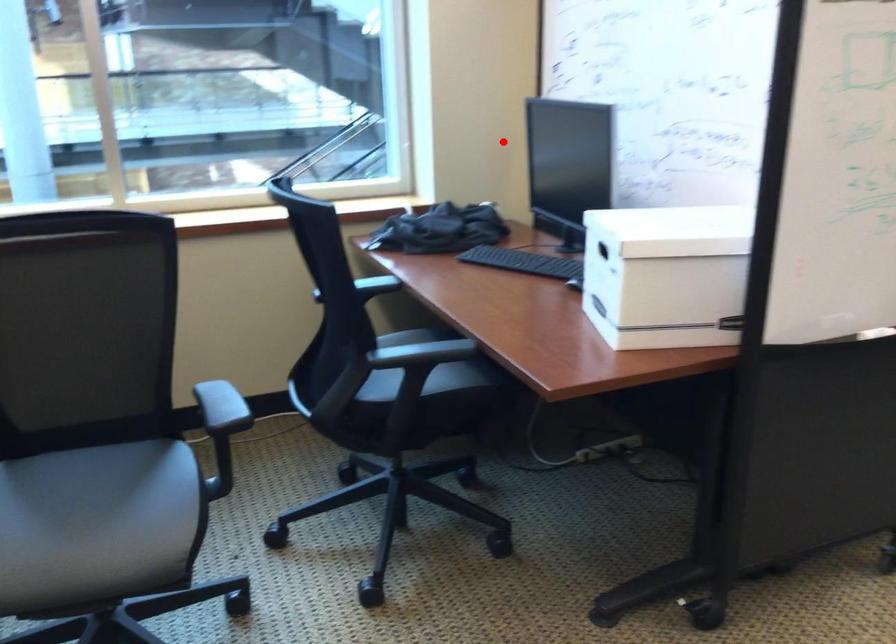
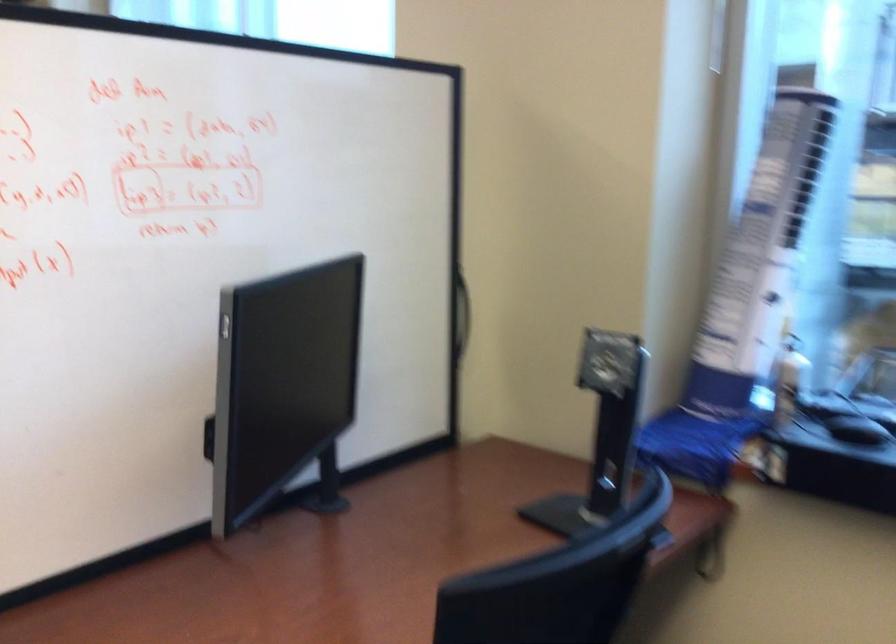
The point at the highlighted location is marked in the first image. Where is the corresponding point in the second image?

(461, 313)